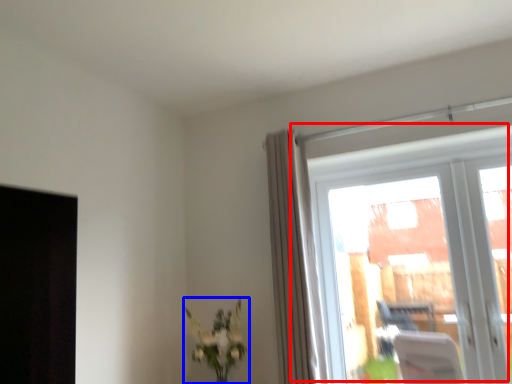
Question: Which object is closer to the camera taking this photo, window (highlighted by a red box) or houseplant (highlighted by a blue box)?

Choices:
 (A) window
 (B) houseplant

Answer: (A)